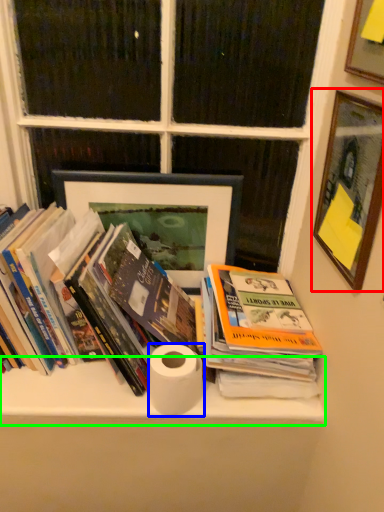
Question: Considering the real-world distances, which object is closest to picture frame (highlighted by a red box)? toilet paper (highlighted by a blue box) or shelf (highlighted by a green box).

Choices:
 (A) toilet paper
 (B) shelf

Answer: (A)